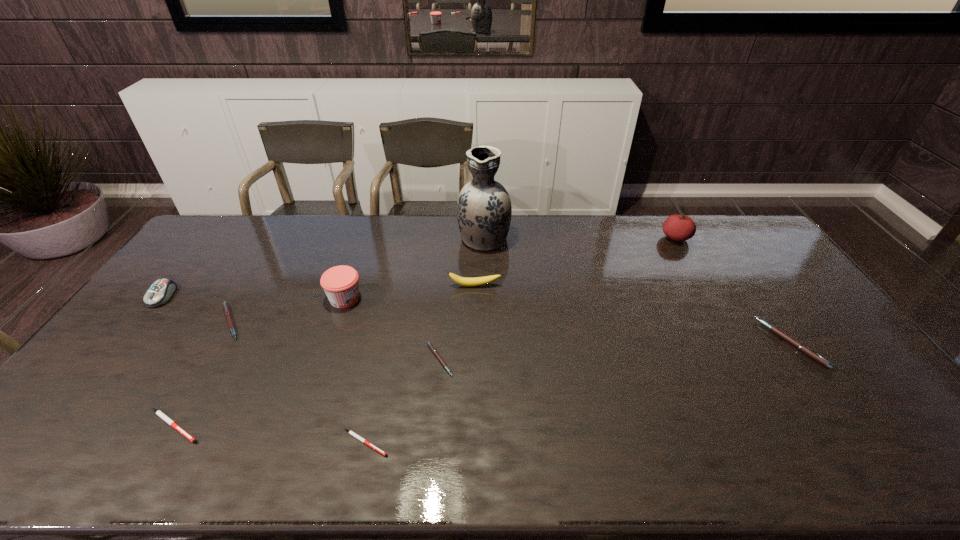
Find the location of a particular element. This screenshot has width=960, height=540. tomato at the far edge is located at coordinates click(x=679, y=228).

Identify the location of object that is at the left edge. (160, 292).

You are a GUI agent. You are given a task and a screenshot of the screen. Output one action in this format:
    pyautogui.click(x=<x>, y=<y>)
    Task: Click on the object present at the right edge
    
    Given the screenshot: What is the action you would take?
    (797, 344)

The image size is (960, 540). Identify the location of vacant point at the far edge. (286, 228).

Where is `blank space at the near edge of the desktop`? The image size is (960, 540). blank space at the near edge of the desktop is located at coordinates (682, 438).

The image size is (960, 540). Find the location of `vacant area at the left edge`. vacant area at the left edge is located at coordinates (105, 417).

In order to click on vacant space at the right edge in this screenshot , I will do `click(852, 417)`.

Find the location of a particular element. vacant area at the far left corner is located at coordinates (208, 234).

Where is `blank space at the near left corner`? The image size is (960, 540). blank space at the near left corner is located at coordinates (10, 470).

Image resolution: width=960 pixels, height=540 pixels. I want to click on free space at the near right corner of the desktop, so click(x=900, y=467).